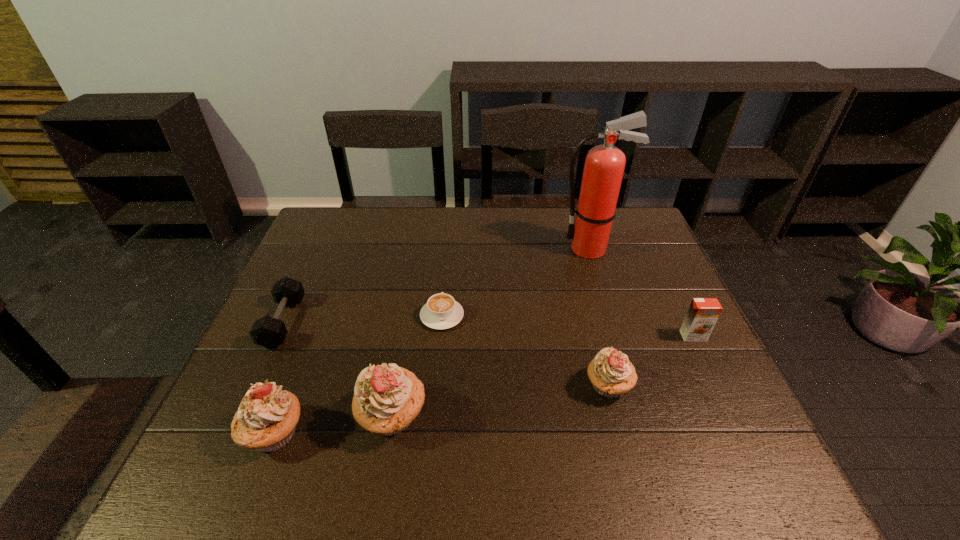
This screenshot has width=960, height=540. In order to click on the leftmost cupcake in this screenshot , I will do `click(266, 419)`.

Find the location of a particular element. This screenshot has width=960, height=540. the second shortest cupcake is located at coordinates (266, 419).

Find the location of `the second cupcake from left to right`. the second cupcake from left to right is located at coordinates point(387,398).

Identify the location of the shortest cupcake. The width and height of the screenshot is (960, 540). pyautogui.click(x=611, y=373).

Image resolution: width=960 pixels, height=540 pixels. I want to click on the tallest object, so click(604, 165).

You are a GUI agent. You are given a task and a screenshot of the screen. Output one action in this format:
    pyautogui.click(x=<x>, y=<y>)
    Task: Click on the farthest object
    The image size is (960, 540).
    Given the screenshot: What is the action you would take?
    pyautogui.click(x=604, y=165)

Locate an element on the screen. orange juice is located at coordinates click(703, 313).

Locate an element on the screen. The image size is (960, 540). dumbbell is located at coordinates (270, 332).

I want to click on cappuccino, so 441,311.

Identify the location of vacant space situated 0.070m on the back of the third tallest object. (295, 379).